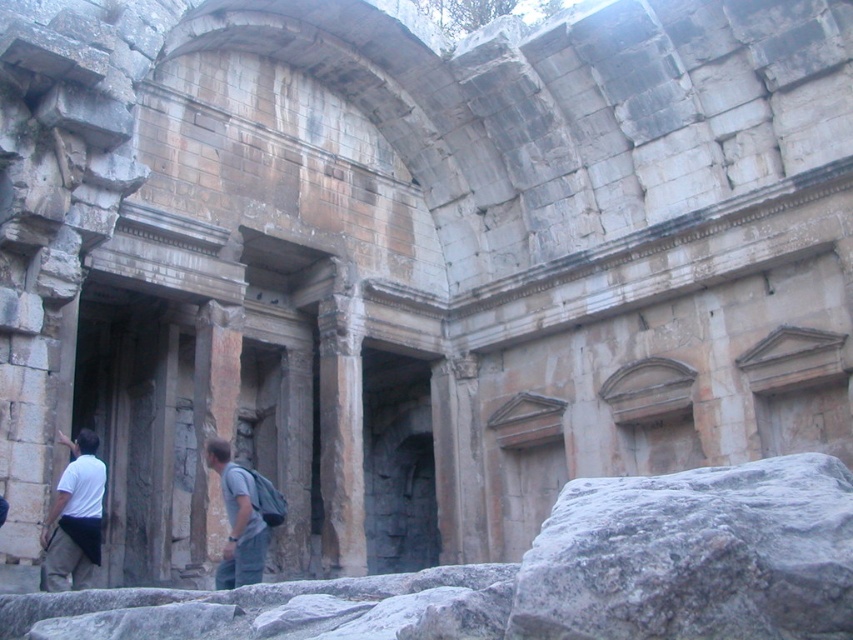
Question: Can you confirm if gray stone boulder at lower right is positioned below white cotton shirt at lower left?

Choices:
 (A) yes
 (B) no

Answer: (B)

Question: Among these objects, which one is nearest to the camera?

Choices:
 (A) gray fabric backpack at lower center
 (B) white fabric backpack at lower left
 (C) white cotton shirt at lower left
 (D) gray stone boulder at lower right

Answer: (D)

Question: Does gray stone boulder at lower right lie behind gray fabric backpack at lower center?

Choices:
 (A) yes
 (B) no

Answer: (B)

Question: Among these objects, which one is nearest to the camera?

Choices:
 (A) white fabric backpack at lower left
 (B) gray stone boulder at lower right

Answer: (B)

Question: Does gray stone boulder at lower right have a lesser width compared to white fabric backpack at lower left?

Choices:
 (A) yes
 (B) no

Answer: (B)

Question: Which object is positioned closest to the gray stone boulder at lower right?

Choices:
 (A) white cotton shirt at lower left
 (B) white fabric backpack at lower left
 (C) gray fabric backpack at lower center

Answer: (C)